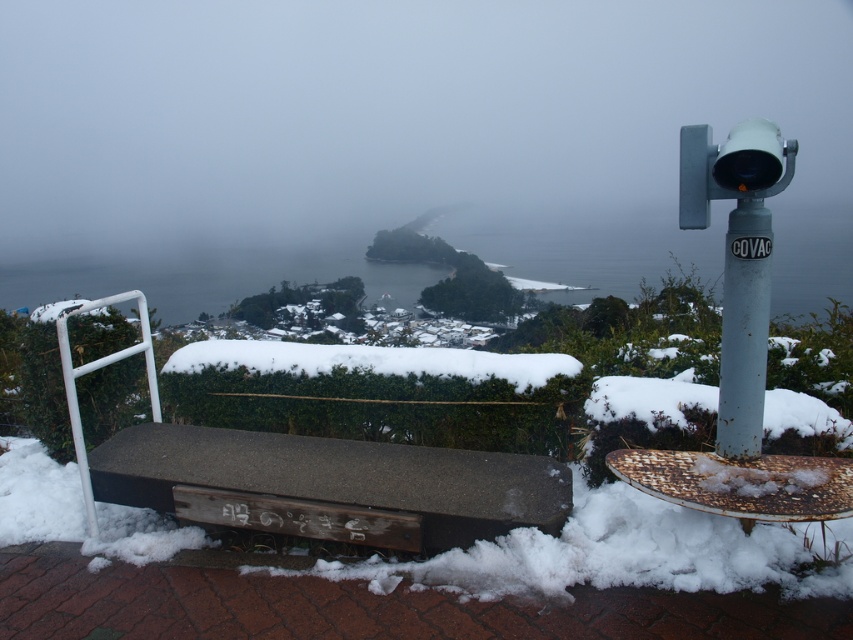
Based on the photo, you are standing on a snowcovered path and want to take a photo of the white fluffy hedge at center and the rusty metal telescope at upper right. Which object should you frame first in your camera viewfinder to ensure both are in the shot?

The white fluffy hedge at center is positioned on the left side of the rusty metal telescope at upper right, so you should frame the white fluffy hedge at center first to ensure both are in the shot.